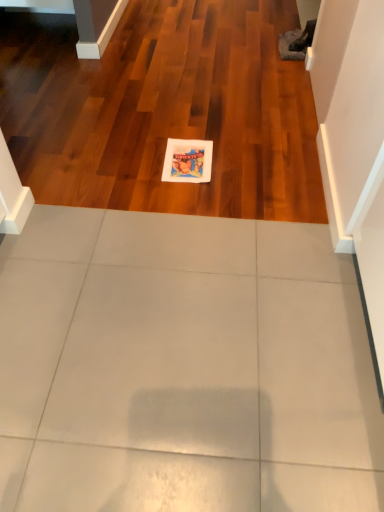
Where is `vacant area that is situated to the right of matte paper postcard at center`? The height and width of the screenshot is (512, 384). vacant area that is situated to the right of matte paper postcard at center is located at coordinates (235, 161).